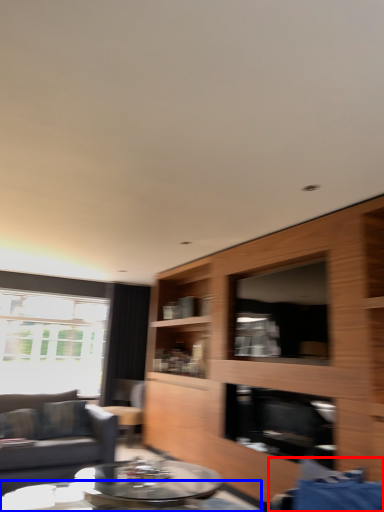
Question: Which object appears closest to the camera in this image, swivel chair (highlighted by a red box) or coffee table (highlighted by a blue box)?

Choices:
 (A) swivel chair
 (B) coffee table

Answer: (A)